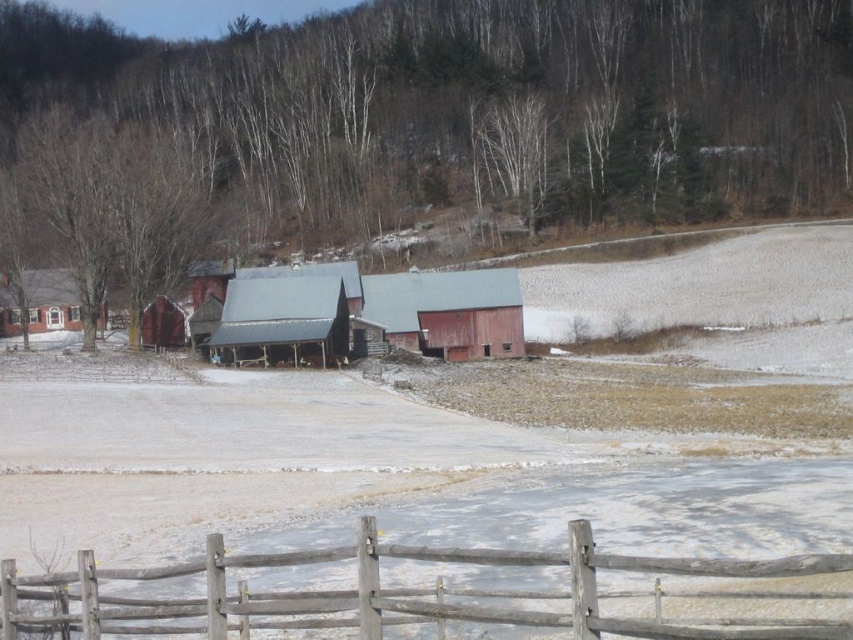
Question: Which of the following is the farthest from the observer?

Choices:
 (A) weathered wood fence at lower center
 (B) brick house at left

Answer: (B)

Question: Does rustic wooden barn at center appear on the right side of brick house at left?

Choices:
 (A) no
 (B) yes

Answer: (B)

Question: Which is nearer to the weathered wood fence at lower center?

Choices:
 (A) brick house at left
 (B) rustic wooden barn at center

Answer: (B)

Question: Considering the real-world distances, which object is farthest from the brick house at left?

Choices:
 (A) weathered wood fence at lower center
 (B) rustic wooden barn at center

Answer: (A)

Question: From the image, what is the correct spatial relationship of weathered wood fence at lower center in relation to rustic wooden barn at center?

Choices:
 (A) left
 (B) right

Answer: (B)

Question: Can you confirm if weathered wood fence at lower center is bigger than rustic wooden barn at center?

Choices:
 (A) no
 (B) yes

Answer: (A)